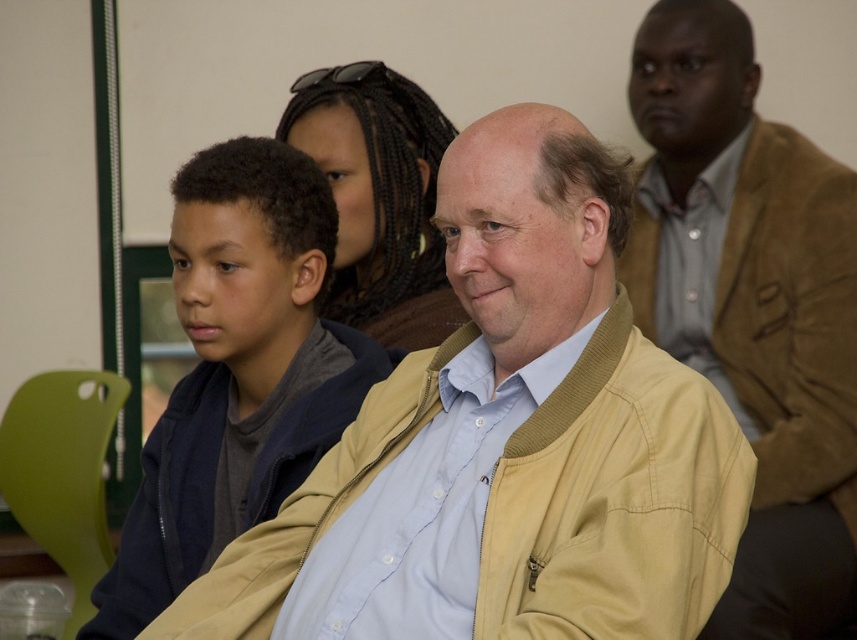
Where is the brown leather jacket at upper right located in the image?

The brown leather jacket at upper right is located at point (752, 305) in the image.

In the scene described, which object is positioned to the right of the other between the light beige jacket at center and the brown braided hair at center?

The light beige jacket at center is positioned to the right of the brown braided hair at center.